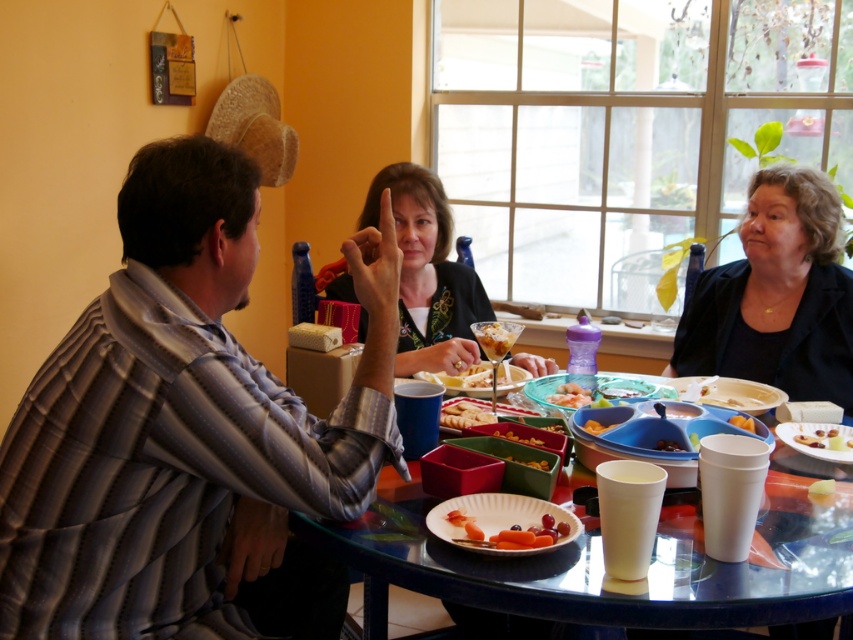
Is carrot sticks at center taller than slightly browned bread at center?

No.

In the scene shown: Does carrot sticks at center have a lesser width compared to slightly browned bread at center?

In fact, carrot sticks at center might be wider than slightly browned bread at center.

Is point (463, 524) more distant than point (483, 346)?

That is False.

I want to click on carrot sticks at center, so click(509, 532).

Identify the location of carrot sticks at center. Image resolution: width=853 pixels, height=640 pixels. (509, 532).

Is carrot sticks at center further to camera compared to smooth yellow cheese at center?

No, carrot sticks at center is in front of smooth yellow cheese at center.

Does point (527, 547) lie in front of point (502, 433)?

Yes, point (527, 547) is closer to viewer.

This screenshot has width=853, height=640. I want to click on carrot sticks at center, so click(509, 532).

Who is lower down, slightly browned bread at center or smooth white cheese sticks at center?

smooth white cheese sticks at center

Does slightly browned bread at center have a lesser height compared to smooth white cheese sticks at center?

Incorrect, slightly browned bread at center's height does not fall short of smooth white cheese sticks at center's.

In order to click on slightly browned bread at center in this screenshot , I will do `click(495, 337)`.

Find the location of a particular element. The height and width of the screenshot is (640, 853). slightly browned bread at center is located at coordinates pos(495,337).